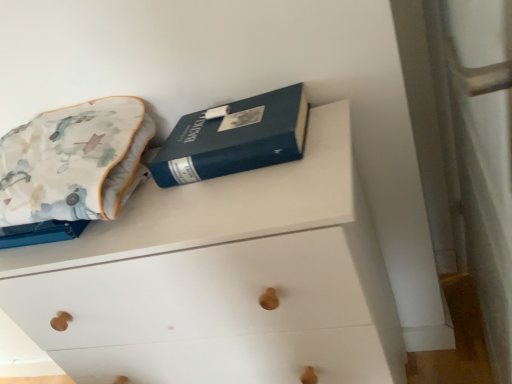
Question: Is the depth of white matte chest of drawers at upper center greater than that of blue hardcover book at upper center?

Choices:
 (A) yes
 (B) no

Answer: (B)

Question: From the image's perspective, is white matte chest of drawers at upper center over blue hardcover book at upper center?

Choices:
 (A) no
 (B) yes

Answer: (A)

Question: Does white matte chest of drawers at upper center have a smaller size compared to blue hardcover book at upper center?

Choices:
 (A) yes
 (B) no

Answer: (B)

Question: Is white matte chest of drawers at upper center oriented away from blue hardcover book at upper center?

Choices:
 (A) no
 (B) yes

Answer: (A)

Question: Is white matte chest of drawers at upper center positioned beyond the bounds of blue hardcover book at upper center?

Choices:
 (A) yes
 (B) no

Answer: (A)

Question: Is fluffy cotton throw pillow at upper left inside or outside of blue hardcover book at upper center?

Choices:
 (A) outside
 (B) inside

Answer: (A)

Question: From the image's perspective, relative to blue hardcover book at upper center, is fluffy cotton throw pillow at upper left above or below?

Choices:
 (A) above
 (B) below

Answer: (B)

Question: Considering the positions of point (100, 195) and point (162, 185), is point (100, 195) closer or farther from the camera than point (162, 185)?

Choices:
 (A) farther
 (B) closer

Answer: (B)

Question: In terms of width, does fluffy cotton throw pillow at upper left look wider or thinner when compared to blue hardcover book at upper center?

Choices:
 (A) wide
 (B) thin

Answer: (A)

Question: From the image's perspective, is blue hardcover book at upper center above or below fluffy cotton throw pillow at upper left?

Choices:
 (A) below
 (B) above

Answer: (B)

Question: In terms of size, does blue hardcover book at upper center appear bigger or smaller than fluffy cotton throw pillow at upper left?

Choices:
 (A) big
 (B) small

Answer: (B)

Question: In terms of width, does blue hardcover book at upper center look wider or thinner when compared to fluffy cotton throw pillow at upper left?

Choices:
 (A) thin
 (B) wide

Answer: (A)

Question: In terms of height, does blue hardcover book at upper center look taller or shorter compared to fluffy cotton throw pillow at upper left?

Choices:
 (A) short
 (B) tall

Answer: (A)

Question: In the image, is fluffy cotton throw pillow at upper left on the left side or the right side of white matte chest of drawers at upper center?

Choices:
 (A) right
 (B) left

Answer: (B)

Question: Considering the positions of point (145, 140) and point (184, 276), is point (145, 140) closer or farther from the camera than point (184, 276)?

Choices:
 (A) farther
 (B) closer

Answer: (A)